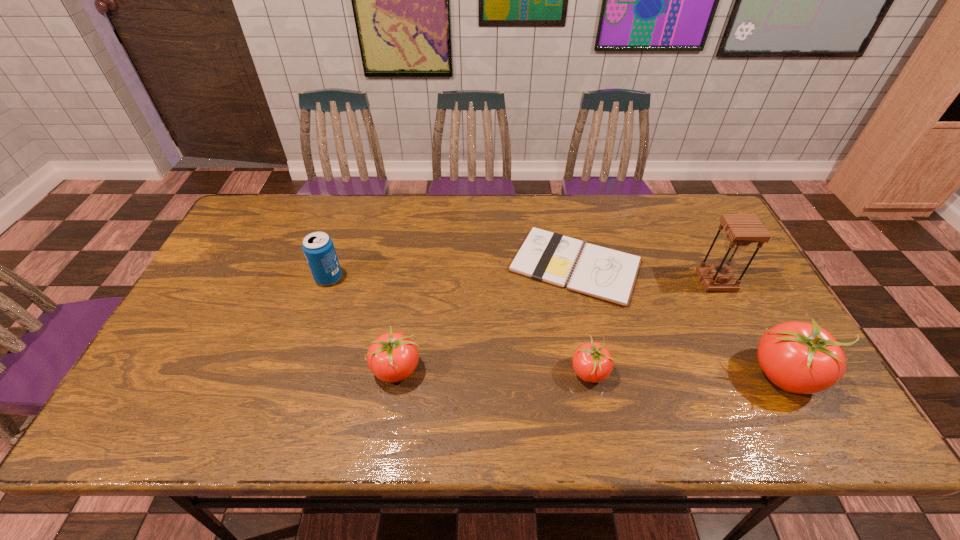
You are a GUI agent. You are given a task and a screenshot of the screen. Output one action in this format:
    pyautogui.click(x=<x>, y=<y>)
    Task: Click on the vacant space located on the back of the tallest tomato
    This screenshot has height=540, width=960.
    Given the screenshot: What is the action you would take?
    pyautogui.click(x=734, y=283)

Image resolution: width=960 pixels, height=540 pixels. I want to click on vacant region located on the front of the shortest object, so click(x=591, y=342).

This screenshot has width=960, height=540. I want to click on vacant region located on the back of the leftmost object, so click(339, 248).

You are a GUI agent. You are given a task and a screenshot of the screen. Output one action in this format:
    pyautogui.click(x=<x>, y=<y>)
    Task: Click on the vacant space located on the front of the tallest object
    The height and width of the screenshot is (540, 960).
    Given the screenshot: What is the action you would take?
    pyautogui.click(x=745, y=339)

I want to click on object that is positioned at the far edge, so click(x=607, y=274).

Find the location of a particular element. This screenshot has height=540, width=960. tomato that is positioned at the right edge is located at coordinates (798, 357).

At what (x,y) coordinates should I click in order to perform the action: click on hourglass that is at the right edge. Please return your answer as a coordinate pair (x, y). The image size is (960, 540). Looking at the image, I should click on (742, 229).

Find the location of a particular element. This screenshot has width=960, height=540. object that is at the near right corner is located at coordinates (798, 357).

Identify the location of free space at the far edge of the desktop. The width and height of the screenshot is (960, 540). (461, 234).

Locate an element on the screen. vacant space at the near edge is located at coordinates (498, 393).